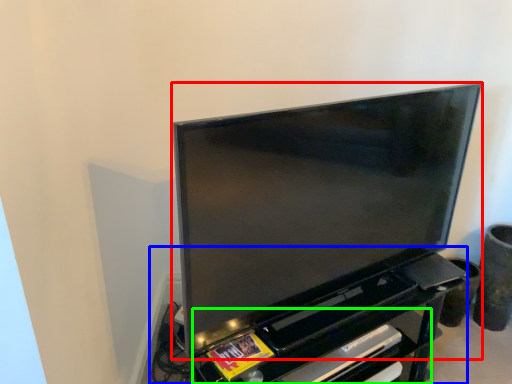
Question: Based on their relative distances, which object is nearer to television (highlighted by a red box)? Choose from entertainment center (highlighted by a blue box) and shelf (highlighted by a green box).

Choices:
 (A) entertainment center
 (B) shelf

Answer: (A)